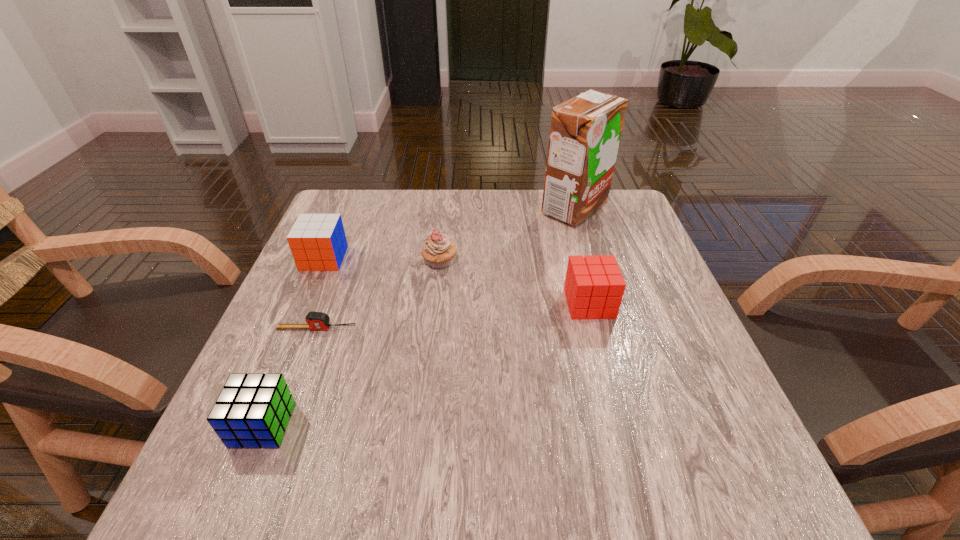
At what (x,y) coordinates should I click in order to perform the action: click on free space between the nearest cube and the second farthest cube. Please return your answer as a coordinate pair (x, y). This screenshot has width=960, height=540. Looking at the image, I should click on (426, 364).

I want to click on free space between the farthest cube and the nearest cube, so click(294, 342).

Where is `free area in between the second farthest cube and the farthest cube`? Image resolution: width=960 pixels, height=540 pixels. free area in between the second farthest cube and the farthest cube is located at coordinates (457, 281).

In order to click on vacant space that's between the farthest cube and the fifth farthest object in this screenshot , I will do `click(321, 293)`.

Find the location of a particular element. vacant area that lies between the farthest cube and the second nearest cube is located at coordinates (457, 281).

Image resolution: width=960 pixels, height=540 pixels. In order to click on vacant space that's between the farthest cube and the tallest object in this screenshot , I will do `click(449, 234)`.

Where is `vacant area that lies between the nearest object and the tape measure`? vacant area that lies between the nearest object and the tape measure is located at coordinates (290, 377).

What are the coordinates of `vacant area between the third object from right to left and the tallest object` in the screenshot? It's located at (507, 235).

What are the coordinates of `vacant point located between the fifth farthest object and the farthest cube` in the screenshot? It's located at (321, 293).

What are the coordinates of `object that is the closest to the fourth object from left to right` in the screenshot? It's located at (317, 242).